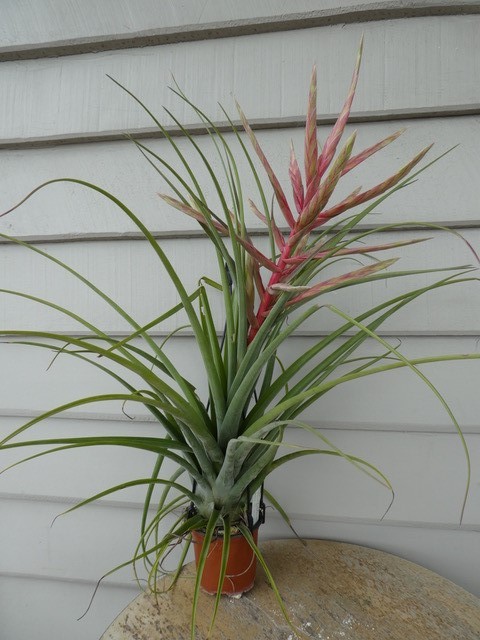
In order to click on table in this screenshot , I will do `click(367, 571)`.